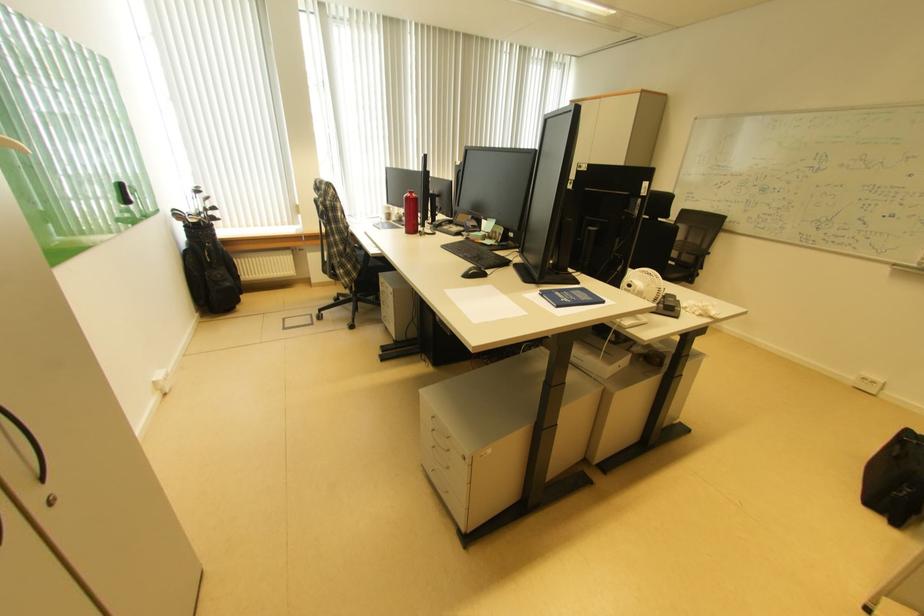
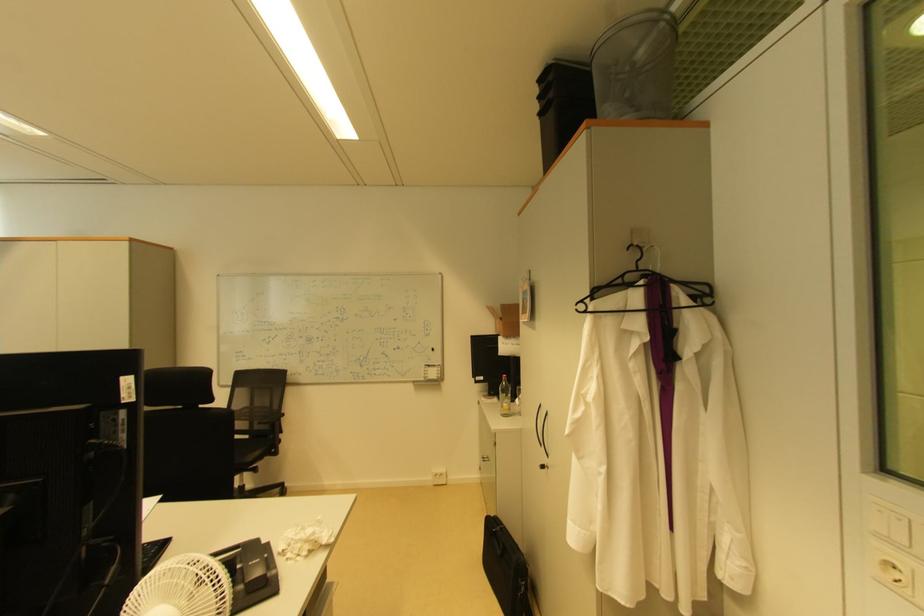
Question: Based on the continuous images, in which direction is the camera rotating? Reply with the corresponding letter.

Choices:
 (A) Left
 (B) Right
 (C) Up
 (D) Down

Answer: (B)